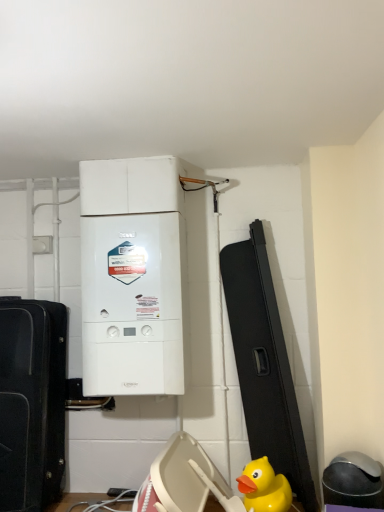
This screenshot has height=512, width=384. Identify the location of black matte suitcase at left. (32, 403).

Where is `yellow rubber duck at lower right`? This screenshot has height=512, width=384. yellow rubber duck at lower right is located at coordinates (264, 488).

You are a GUI agent. You are given a task and a screenshot of the screen. Output one action in this format:
    pyautogui.click(x=<x>, y=<y>)
    Task: Click on the black matte suitcase at left
    
    Given the screenshot: What is the action you would take?
    [32, 403]

From a real-world perspective, does black matte suitcase at left sit lower than yellow rubber duck at lower right?

No, from a real-world perspective, black matte suitcase at left is not under yellow rubber duck at lower right.

Is black matte suitcase at left in front of or behind yellow rubber duck at lower right in the image?

black matte suitcase at left is behind yellow rubber duck at lower right.

The height and width of the screenshot is (512, 384). What are the coordinates of `duck below the black matte suitcase at left (from a real-world perspective)` in the screenshot? It's located at (264, 488).

Considering the relative positions of white matte boiler at center and yellow rubber duck at lower right in the image provided, is white matte boiler at center in front of yellow rubber duck at lower right?

No, it is behind yellow rubber duck at lower right.

From the image's perspective, which one is positioned lower, white matte boiler at center or yellow rubber duck at lower right?

From the image's view, yellow rubber duck at lower right is below.

From a real-world perspective, between white matte boiler at center and yellow rubber duck at lower right, who is vertically lower?

yellow rubber duck at lower right, from a real-world perspective.

Considering the relative sizes of white matte boiler at center and yellow rubber duck at lower right in the image provided, is white matte boiler at center bigger than yellow rubber duck at lower right?

Correct, white matte boiler at center is larger in size than yellow rubber duck at lower right.

Considering the sizes of objects black matte suitcase at left and white matte boiler at center in the image provided, who is smaller, black matte suitcase at left or white matte boiler at center?

black matte suitcase at left.

From a real-world perspective, is black matte suitcase at left positioned above or below white matte boiler at center?

In terms of real-world spatial position, black matte suitcase at left is below white matte boiler at center.

How different are the orientations of black matte suitcase at left and white matte boiler at center in degrees?

The angular difference between black matte suitcase at left and white matte boiler at center is 4.04 degrees.

Considering the positions of point (19, 505) and point (175, 329), is point (19, 505) closer or farther from the camera than point (175, 329)?

Point (19, 505) is closer to the camera than point (175, 329).

From their relative heights in the image, would you say yellow rubber duck at lower right is taller or shorter than black matte suitcase at left?

Considering their sizes, yellow rubber duck at lower right has less height than black matte suitcase at left.

Could black matte suitcase at left be considered to be inside yellow rubber duck at lower right?

No, yellow rubber duck at lower right does not contain black matte suitcase at left.

Between yellow rubber duck at lower right and black matte suitcase at left, which one has larger width?

black matte suitcase at left.

Locate an element on the screen. duck below the black matte suitcase at left (from the image's perspective) is located at coordinates (264, 488).

How different are the orientations of white matte boiler at center and black matte suitcase at left in degrees?

The facing directions of white matte boiler at center and black matte suitcase at left are 4.04 degrees apart.

Does point (122, 284) lie behind point (50, 364)?

No.

Does white matte boiler at center contain black matte suitcase at left?

Actually, black matte suitcase at left is outside white matte boiler at center.

From a real-world perspective, who is located higher, white matte boiler at center or black matte suitcase at left?

From a 3D spatial view, white matte boiler at center is above.

Is yellow rubber duck at lower right aimed at white matte boiler at center?

No, yellow rubber duck at lower right is not oriented towards white matte boiler at center.

Is yellow rubber duck at lower right to the left of white matte boiler at center from the viewer's perspective?

No.

Between point (241, 490) and point (169, 338), which one is positioned behind?

The point (169, 338) is behind.

From the image's perspective, is yellow rubber duck at lower right under white matte boiler at center?

Yes, from the image's perspective, yellow rubber duck at lower right is below white matte boiler at center.

Image resolution: width=384 pixels, height=512 pixels. Find the location of `duck on the right of black matte suitcase at left`. duck on the right of black matte suitcase at left is located at coordinates (264, 488).

This screenshot has height=512, width=384. I want to click on duck beneath the white matte boiler at center (from a real-world perspective), so click(264, 488).

When comparing their distances from yellow rubber duck at lower right, does white matte boiler at center or black matte suitcase at left seem closer?

white matte boiler at center.

When comparing their distances from black matte suitcase at left, does yellow rubber duck at lower right or white matte boiler at center seem closer?

Based on the image, white matte boiler at center appears to be nearer to black matte suitcase at left.

When comparing their distances from white matte boiler at center, does yellow rubber duck at lower right or black matte suitcase at left seem further?

The object further to white matte boiler at center is yellow rubber duck at lower right.

Estimate the real-world distances between objects in this image. Which object is further from white matte boiler at center, black matte suitcase at left or yellow rubber duck at lower right?

yellow rubber duck at lower right.

Estimate the real-world distances between objects in this image. Which object is closer to yellow rubber duck at lower right, black matte suitcase at left or white matte boiler at center?

white matte boiler at center is positioned closer to the anchor yellow rubber duck at lower right.

Estimate the real-world distances between objects in this image. Which object is further from black matte suitcase at left, white matte boiler at center or yellow rubber duck at lower right?

yellow rubber duck at lower right.

The height and width of the screenshot is (512, 384). Identify the location of home appliance located between black matte suitcase at left and yellow rubber duck at lower right in the left-right direction. (132, 277).